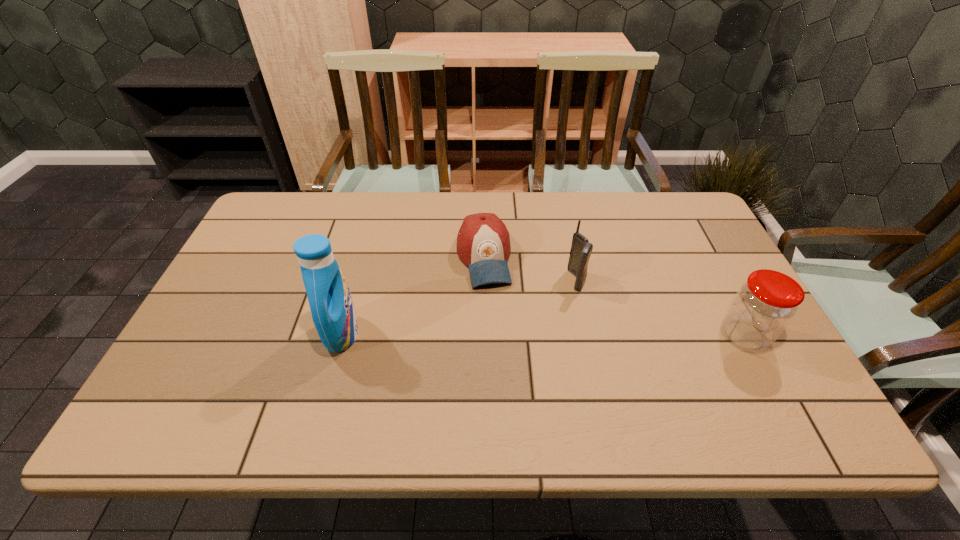
Locate an element on the screen. The width and height of the screenshot is (960, 540). free spot at the near left corner of the desktop is located at coordinates (210, 366).

Locate an element on the screen. The width and height of the screenshot is (960, 540). vacant space at the near right corner of the desktop is located at coordinates (785, 390).

This screenshot has width=960, height=540. In order to click on vacant area that lies between the shortest object and the leftmost object in this screenshot , I will do `click(413, 296)`.

This screenshot has width=960, height=540. What are the coordinates of `free space between the second object from left to right and the cellular telephone` in the screenshot? It's located at (530, 269).

The width and height of the screenshot is (960, 540). Find the location of `free point between the third object from left to right and the second object from left to right`. free point between the third object from left to right and the second object from left to right is located at coordinates (530, 269).

Identify the location of vacant area between the jar and the third object from right to left. (613, 297).

This screenshot has width=960, height=540. Find the location of `free space that is in between the third object from right to left and the jar`. free space that is in between the third object from right to left and the jar is located at coordinates (613, 297).

Locate an element on the screen. This screenshot has width=960, height=540. vacant area that lies between the leftmost object and the baseball cap is located at coordinates (413, 296).

At what (x,y) coordinates should I click in order to perform the action: click on empty space between the jar and the detergent. Please return your answer as a coordinate pair (x, y). The height and width of the screenshot is (540, 960). Looking at the image, I should click on (543, 335).

At what (x,y) coordinates should I click in order to perform the action: click on free space that is in between the leftmost object and the baseball cap. Please return your answer as a coordinate pair (x, y). The height and width of the screenshot is (540, 960). Looking at the image, I should click on (413, 296).